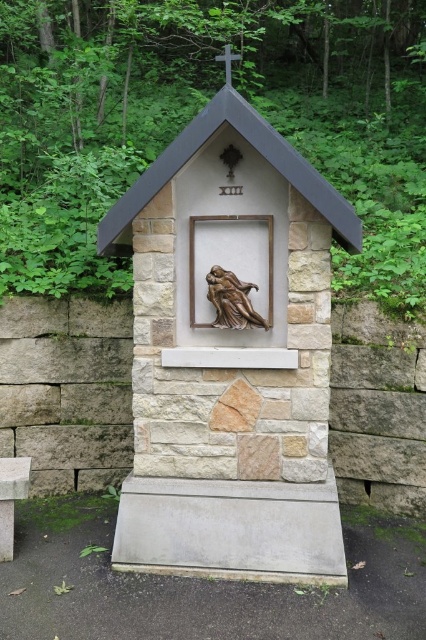
You are standing in front of the stone structure and want to place a small offering. There are two points marked on the structure where you can place it. One is at point [230,228] and the other is at point [258,312]. Which point is closer to you?

Point [230,228] is further to the camera than point [258,312], so the point closer to you is point [258,312].